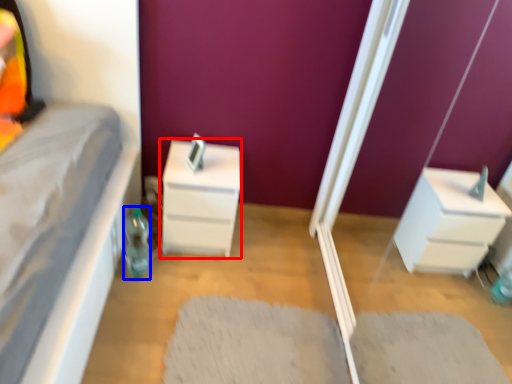
Question: Which point is closer to the camera, chest of drawers (highlighted by a red box) or bottle (highlighted by a blue box)?

Choices:
 (A) chest of drawers
 (B) bottle

Answer: (B)